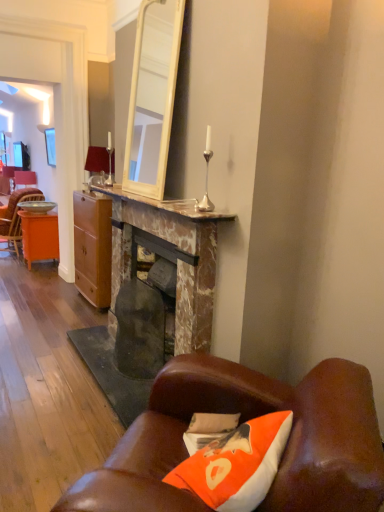
Question: Is orange wood desk at left bigger or smaller than marble fireplace at center?

Choices:
 (A) small
 (B) big

Answer: (A)

Question: Is orange wood desk at left taller or shorter than marble fireplace at center?

Choices:
 (A) short
 (B) tall

Answer: (A)

Question: Estimate the real-world distances between objects in this image. Which object is closer to the marble fireplace at center?

Choices:
 (A) orange wood chair at left, which appears as the first chair when ordered from the bottom
 (B) matte silver lamp at upper left
 (C) matte wood cabinet at center
 (D) marble fireplace at center
 (E) leather couch at lower right

Answer: (D)

Question: Which object is positioned closest to the orange wood chair at left, the second chair when ordered from back to front?

Choices:
 (A) matte silver lamp at upper left
 (B) marble fireplace at center
 (C) orange wood desk at left
 (D) matte orange cushion at lower left, the 1th chair from the back
 (E) matte wood cabinet at center

Answer: (D)